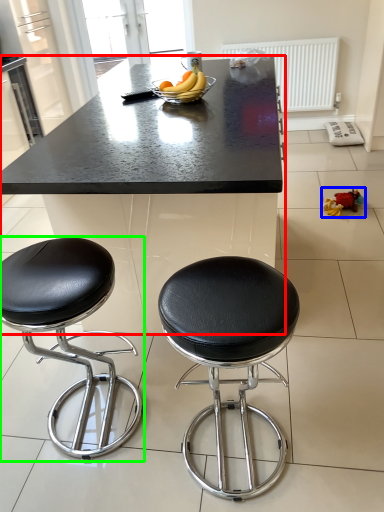
Question: Which object is positioned farthest from table (highlighted by a red box)? Select from toy (highlighted by a blue box) and stool (highlighted by a green box).

Choices:
 (A) toy
 (B) stool

Answer: (A)